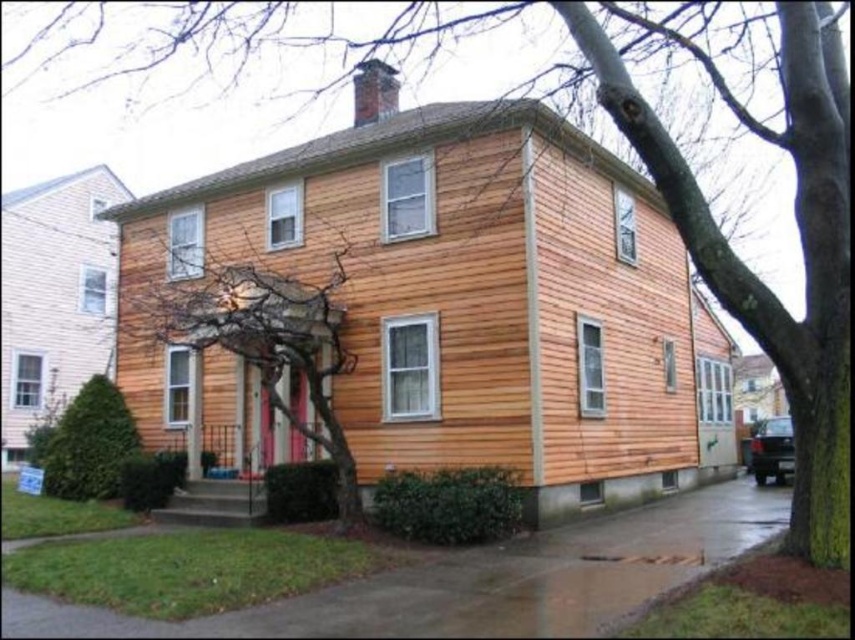
You are a landscape architect planning to add a new garden feature between the brown textured tree at center and the green leafy bush at lower left. Considering their sizes, which object should you place closer to the smaller one to maintain balance?

The brown textured tree at center is smaller than the green leafy bush at lower left, so you should place the garden feature closer to the brown textured tree at center to balance their sizes.

Consider the image. You are a gardener planning to plant a new flower bed between the brown textured tree at center and the green leafy bush at lower left. The flower bed requires a minimum of 15 feet of space. Based on the scene, will there be enough space for the flower bed?

The brown textured tree at center and green leafy bush at lower left are 16.97 feet apart, which exceeds the required 15 feet, so there is enough space for the flower bed.